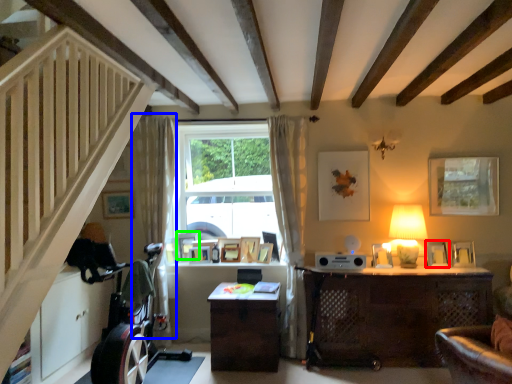
Question: Which object is positioned farthest from picture frame (highlighted by a red box)? Select from curtain (highlighted by a blue box) and picture frame (highlighted by a green box).

Choices:
 (A) curtain
 (B) picture frame

Answer: (A)